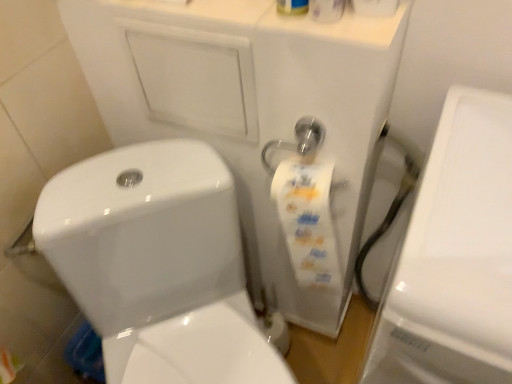
Where is `vacant point to the left of white glossy toilet paper at upper center`? The height and width of the screenshot is (384, 512). vacant point to the left of white glossy toilet paper at upper center is located at coordinates [273, 23].